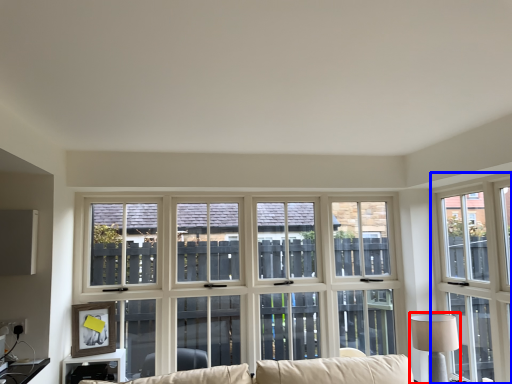
Question: Which point is further to the camera, table lamp (highlighted by a red box) or window (highlighted by a blue box)?

Choices:
 (A) table lamp
 (B) window

Answer: (A)